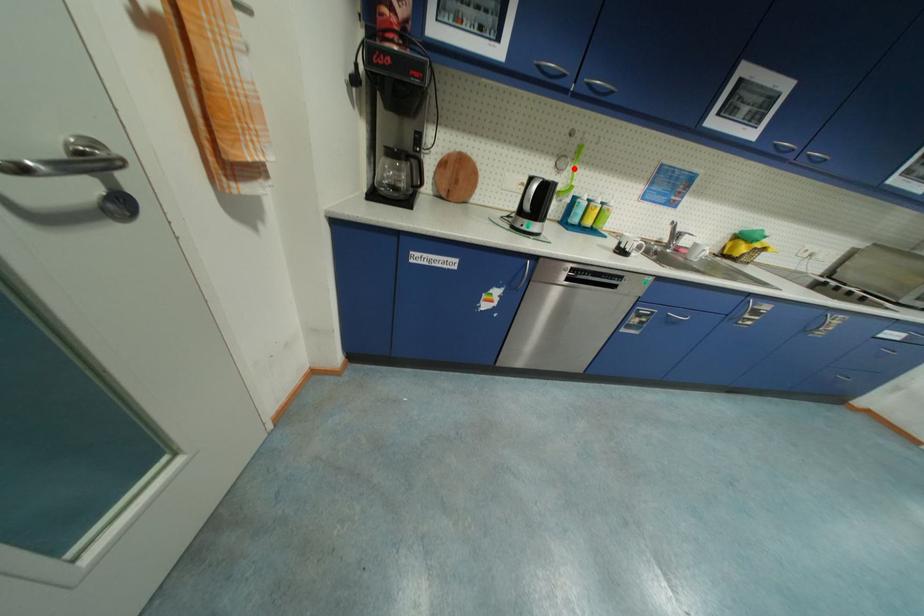
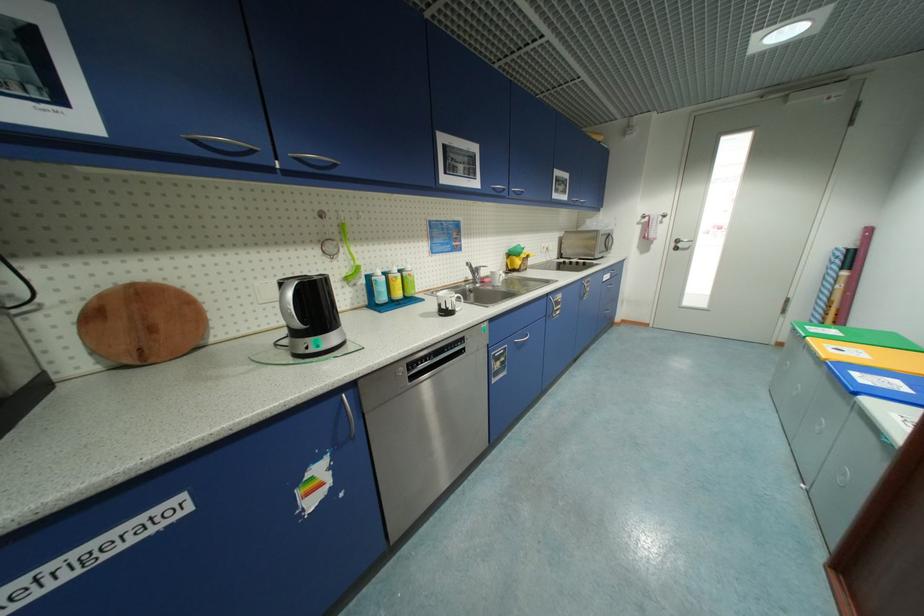
The point at the highlighted location is marked in the first image. Where is the corresponding point in the second image?

(347, 251)